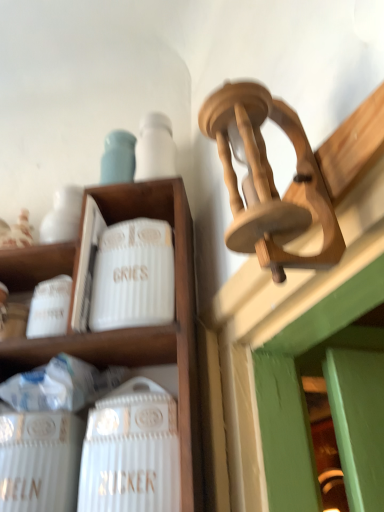
Question: In terms of height, does white ceramic wine bottle at lower left look taller or shorter compared to white ceramic canister at upper left?

Choices:
 (A) tall
 (B) short

Answer: (B)

Question: From the image's perspective, is white ceramic wine bottle at lower left located above or below white ceramic canister at upper left?

Choices:
 (A) below
 (B) above

Answer: (A)

Question: Estimate the real-world distances between objects in this image. Which object is farther from the white ceramic wine bottle at lower left?

Choices:
 (A) white ribbed ceramic canister at center-left
 (B) white ceramic canister at upper left

Answer: (A)

Question: Based on their relative distances, which object is farther from the white ribbed ceramic canister at center-left?

Choices:
 (A) white ceramic canister at upper left
 (B) white ceramic wine bottle at lower left

Answer: (B)